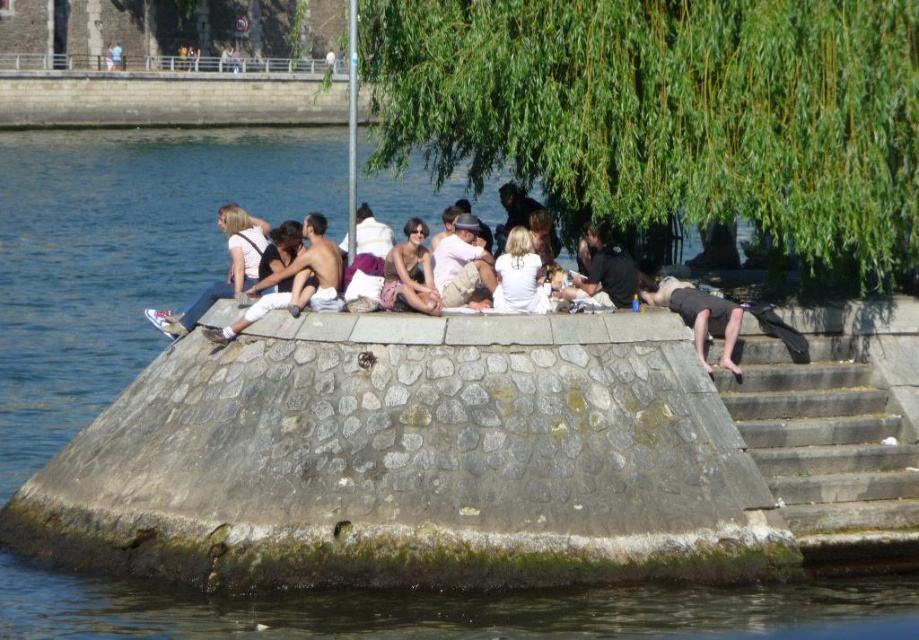
Question: Among these objects, which one is nearest to the camera?

Choices:
 (A) black cotton shirt at center
 (B) light brown cotton pants at center

Answer: (B)

Question: Can you confirm if denim pants at center is smaller than light brown cotton pants at center?

Choices:
 (A) no
 (B) yes

Answer: (A)

Question: Does stone stairs at lower right appear over dark gray stone person at lower right?

Choices:
 (A) yes
 (B) no

Answer: (B)

Question: Observing the image, what is the correct spatial positioning of matte black tank top at center in reference to white cotton shirt at center?

Choices:
 (A) below
 (B) above

Answer: (B)

Question: Estimate the real-world distances between objects in this image. Which object is farther from the dark gray stone person at lower right?

Choices:
 (A) black cotton shirt at center
 (B) stone stairs at lower right
 (C) white cotton shirt at center
 (D) light brown cotton pants at center

Answer: (B)

Question: Which point is closer to the camera taking this photo?

Choices:
 (A) (x=239, y=259)
 (B) (x=450, y=244)

Answer: (B)